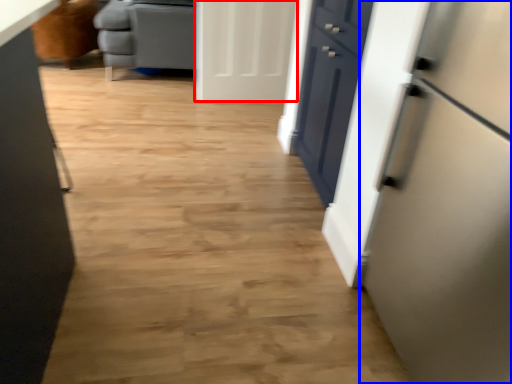
Question: Which object is closer to the camera taking this photo, door (highlighted by a red box) or refrigerator (highlighted by a blue box)?

Choices:
 (A) door
 (B) refrigerator

Answer: (B)